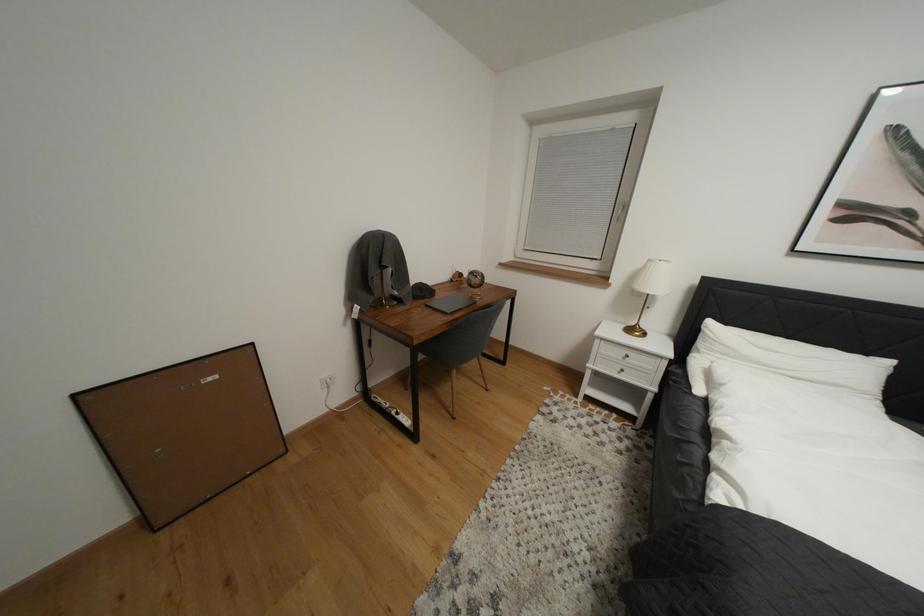
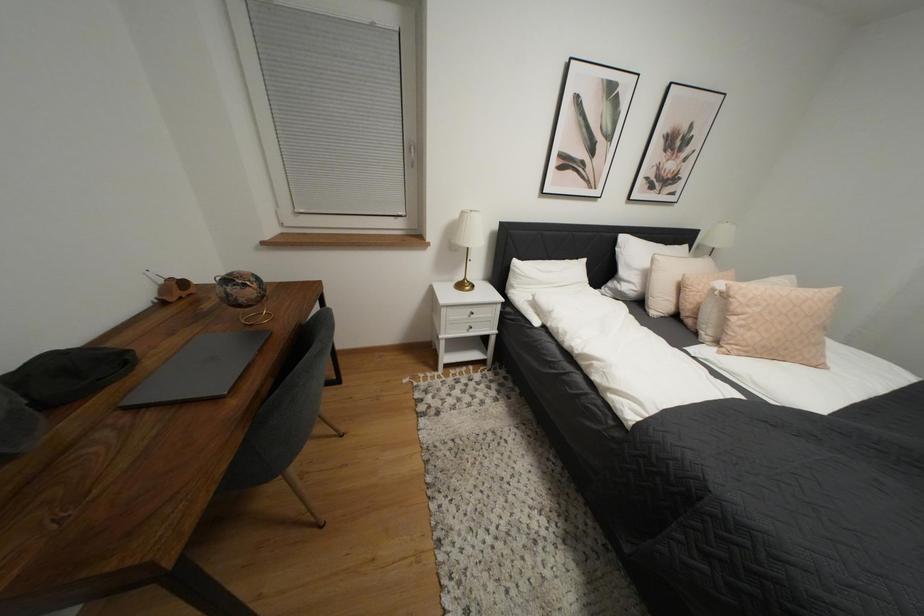
Based on the continuous images, in which direction is the camera rotating?

The camera's rotation is toward right-down.